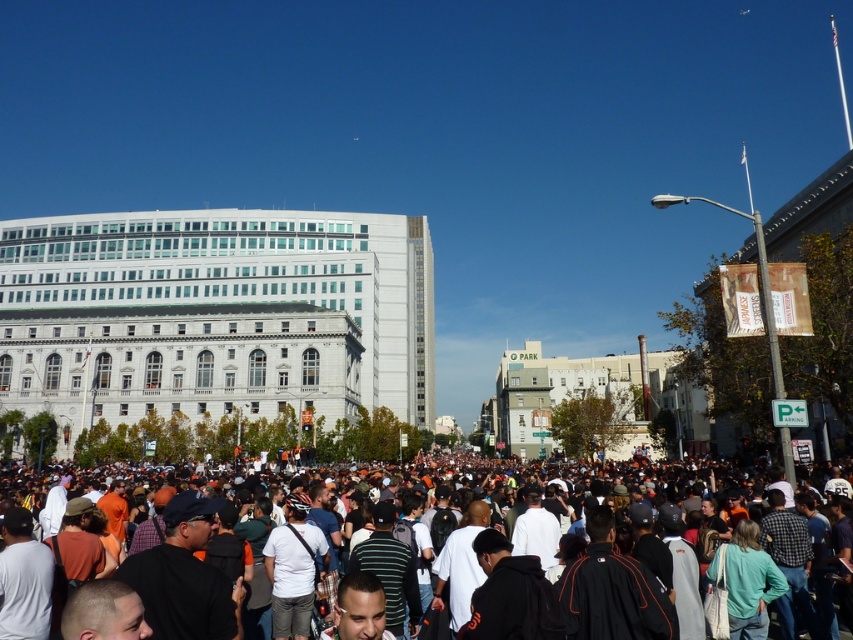
You are a photographer standing in the crowd and want to take a photo of the white marble building at center. Since the orange fabric crowd at center is blocking your view, can you move to the left to get a clear shot? Explain your reasoning based on their positions.

The white marble building at center is closer to you than the orange fabric crowd at center. Since the crowd is behind the building, moving to the left might not help as the building itself could block the view. Alternatively, moving back might provide a better angle to see over the crowd.

You are standing at the camera position and want to reach the point at coordinates [268,269] in the image. Given that the distance between them is 112.97 meters, can you estimate how far you need to walk to reach that point?

The point at coordinates [268,269] is 112.97 meters away from the camera position, so you would need to walk approximately 112.97 meters to reach it.